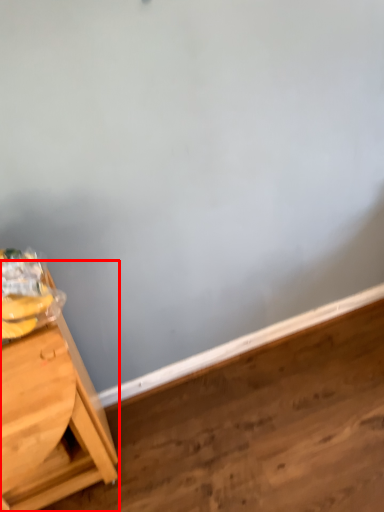
Question: From the image's perspective, where is table (annotated by the red box) located in relation to plywood in the image?

Choices:
 (A) below
 (B) above

Answer: (B)